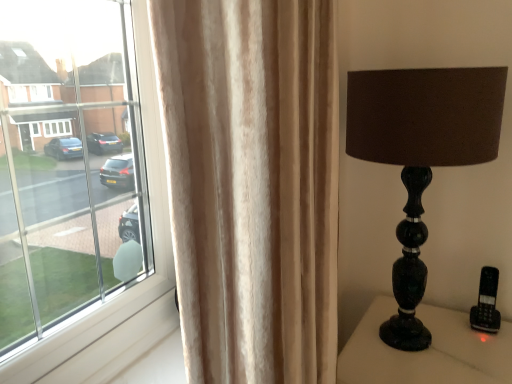
Question: Considering the relative sizes of black marble lamp at right and beige velvet curtain at left in the image provided, is black marble lamp at right smaller than beige velvet curtain at left?

Choices:
 (A) no
 (B) yes

Answer: (A)

Question: From the image's perspective, is black marble lamp at right over beige velvet curtain at left?

Choices:
 (A) no
 (B) yes

Answer: (A)

Question: From a real-world perspective, is black marble lamp at right below beige velvet curtain at left?

Choices:
 (A) yes
 (B) no

Answer: (A)

Question: Is black marble lamp at right turned away from beige velvet curtain at left?

Choices:
 (A) no
 (B) yes

Answer: (A)

Question: From a real-world perspective, is black marble lamp at right over beige velvet curtain at left?

Choices:
 (A) yes
 (B) no

Answer: (B)

Question: Does black marble lamp at right have a lesser width compared to beige velvet curtain at left?

Choices:
 (A) no
 (B) yes

Answer: (A)

Question: From the image's perspective, is beige velvet curtain at left located above shiny black glass lamp at right?

Choices:
 (A) no
 (B) yes

Answer: (A)

Question: Considering the relative positions of beige velvet curtain at left and shiny black glass lamp at right in the image provided, is beige velvet curtain at left behind shiny black glass lamp at right?

Choices:
 (A) no
 (B) yes

Answer: (A)

Question: Is beige velvet curtain at left taller than shiny black glass lamp at right?

Choices:
 (A) yes
 (B) no

Answer: (A)

Question: Is beige velvet curtain at left at the left side of shiny black glass lamp at right?

Choices:
 (A) no
 (B) yes

Answer: (B)

Question: Is beige velvet curtain at left oriented towards shiny black glass lamp at right?

Choices:
 (A) no
 (B) yes

Answer: (A)

Question: Is beige velvet curtain at left in contact with shiny black glass lamp at right?

Choices:
 (A) no
 (B) yes

Answer: (A)

Question: Considering the relative sizes of black marble lamp at right and shiny black glass lamp at right in the image provided, is black marble lamp at right thinner than shiny black glass lamp at right?

Choices:
 (A) yes
 (B) no

Answer: (B)